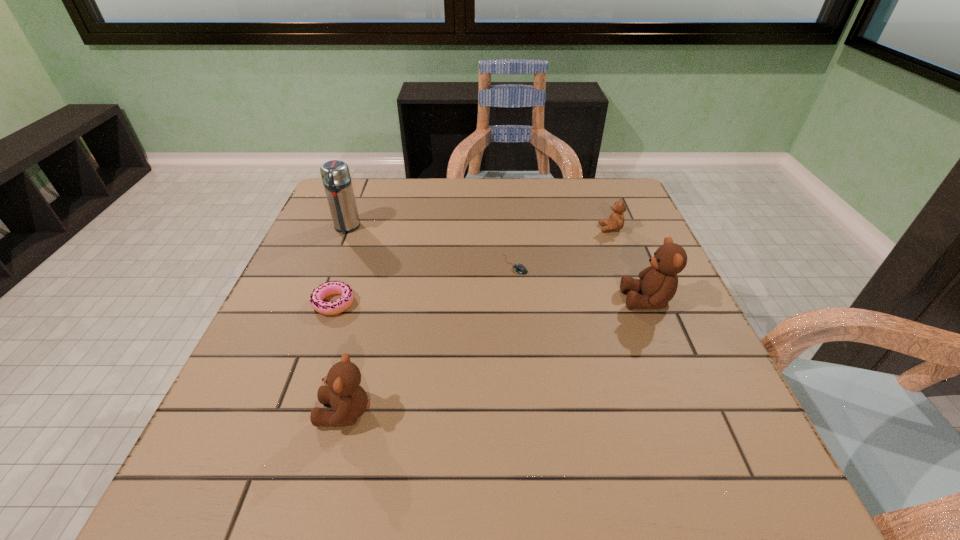
Locate an element on the screen. The image size is (960, 540). vacant space at the left edge of the desktop is located at coordinates (286, 295).

Where is `free location at the right edge`? This screenshot has width=960, height=540. free location at the right edge is located at coordinates (603, 240).

Where is `vacant space at the far right corner of the desktop`? vacant space at the far right corner of the desktop is located at coordinates (581, 201).

Find the location of a particular element. This screenshot has height=540, width=960. free space at the near right corner of the desktop is located at coordinates (671, 420).

Image resolution: width=960 pixels, height=540 pixels. I want to click on vacant space that is in between the leftmost teddy bear and the thermos bottle, so click(x=346, y=320).

Where is `free spot between the mouse and the farthest teddy bear`? This screenshot has width=960, height=540. free spot between the mouse and the farthest teddy bear is located at coordinates (563, 246).

Identify the location of free space between the tallest object and the nearest teddy bear. This screenshot has width=960, height=540. (346, 320).

In order to click on free space between the thermos bottle and the mouse in this screenshot , I will do `click(431, 246)`.

Image resolution: width=960 pixels, height=540 pixels. I want to click on vacant area that lies between the thermos bottle and the shortest teddy bear, so click(x=478, y=228).

Where is `vacant point located between the thermos bottle and the fifth tallest object`? vacant point located between the thermos bottle and the fifth tallest object is located at coordinates (340, 265).